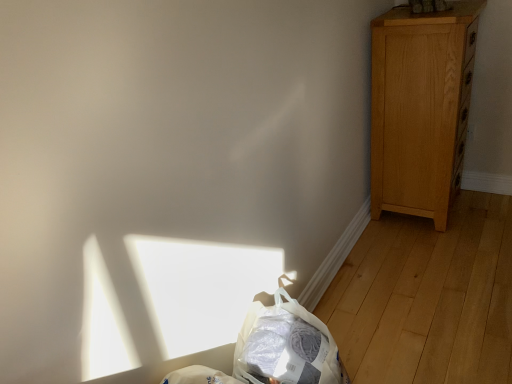
Question: From a real-world perspective, is translucent plastic bag at lower center located beneath light brown wood dresser at right?

Choices:
 (A) no
 (B) yes

Answer: (B)

Question: From a real-world perspective, is translucent plastic bag at lower center physically above light brown wood dresser at right?

Choices:
 (A) yes
 (B) no

Answer: (B)

Question: From the image's perspective, is translucent plastic bag at lower center under light brown wood dresser at right?

Choices:
 (A) no
 (B) yes

Answer: (B)

Question: Could you tell me if translucent plastic bag at lower center is turned towards light brown wood dresser at right?

Choices:
 (A) no
 (B) yes

Answer: (A)

Question: Does translucent plastic bag at lower center come in front of light brown wood dresser at right?

Choices:
 (A) no
 (B) yes

Answer: (B)

Question: Is light brown wood dresser at right located within translucent plastic bag at lower center?

Choices:
 (A) no
 (B) yes

Answer: (A)

Question: Is light brown wood dresser at right positioned beyond the bounds of translucent plastic bag at lower center?

Choices:
 (A) yes
 (B) no

Answer: (A)

Question: Is light brown wood dresser at right further to camera compared to translucent plastic bag at lower center?

Choices:
 (A) no
 (B) yes

Answer: (B)

Question: Is light brown wood dresser at right taller than translucent plastic bag at lower center?

Choices:
 (A) yes
 (B) no

Answer: (A)

Question: Could you tell me if light brown wood dresser at right is facing translucent plastic bag at lower center?

Choices:
 (A) yes
 (B) no

Answer: (B)

Question: Does light brown wood dresser at right have a lesser width compared to translucent plastic bag at lower center?

Choices:
 (A) yes
 (B) no

Answer: (B)

Question: Are light brown wood dresser at right and translucent plastic bag at lower center making contact?

Choices:
 (A) no
 (B) yes

Answer: (A)

Question: Visually, is translucent plastic bag at lower center positioned to the left or to the right of light brown wood dresser at right?

Choices:
 (A) left
 (B) right

Answer: (A)